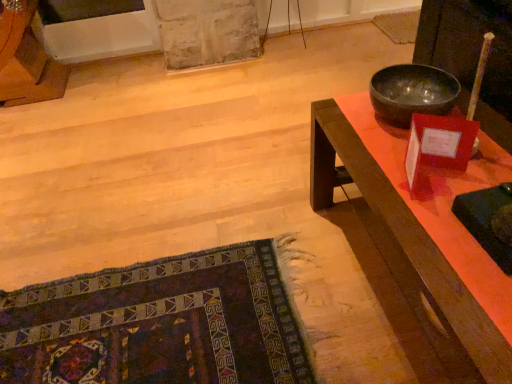
Question: Looking at their shapes, would you say wooden desk at right is wider or thinner than dark woven rug at lower left?

Choices:
 (A) thin
 (B) wide

Answer: (A)

Question: In the image, is wooden desk at right positioned in front of or behind dark woven rug at lower left?

Choices:
 (A) behind
 (B) front

Answer: (B)

Question: Considering the real-world distances, which object is farthest from the dark woven rug at lower left?

Choices:
 (A) shiny metallic bowl at upper right
 (B) wooden desk at right

Answer: (A)

Question: Which object is the closest to the dark woven rug at lower left?

Choices:
 (A) wooden desk at right
 (B) shiny metallic bowl at upper right

Answer: (A)